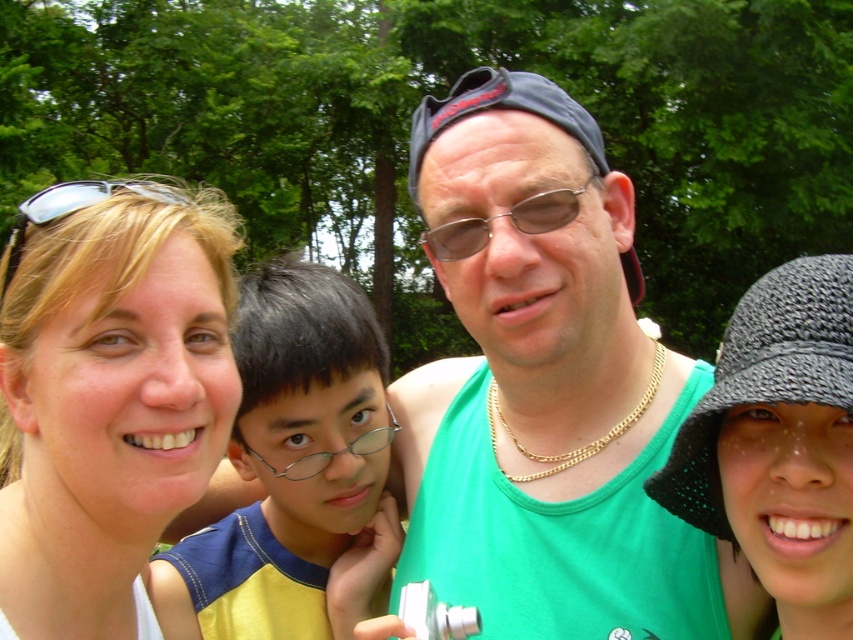
Question: Does green fabric tank top at center appear over blonde hair at upper left?

Choices:
 (A) no
 (B) yes

Answer: (B)

Question: Based on their relative distances, which object is nearer to the green fabric tank top at center?

Choices:
 (A) blonde hair at upper left
 (B) yellow fabric shirt at center

Answer: (B)

Question: Does blonde hair at upper left have a greater width compared to yellow fabric shirt at center?

Choices:
 (A) yes
 (B) no

Answer: (B)

Question: Which point is farther to the camera?

Choices:
 (A) green fabric tank top at center
 (B) blonde hair at upper left
 (C) yellow fabric shirt at center

Answer: (C)

Question: Estimate the real-world distances between objects in this image. Which object is closer to the yellow fabric shirt at center?

Choices:
 (A) green fabric tank top at center
 (B) blonde hair at upper left

Answer: (A)

Question: In this image, where is green fabric tank top at center located relative to blonde hair at upper left?

Choices:
 (A) left
 (B) right

Answer: (B)